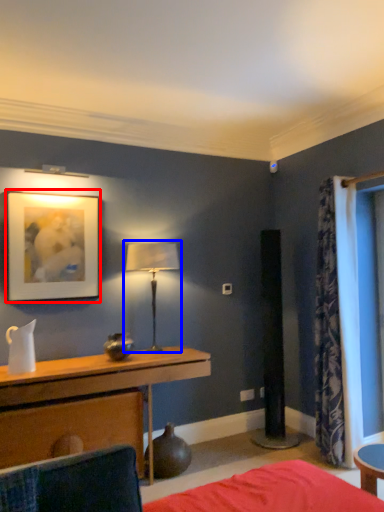
Question: Which object appears farthest to the camera in this image, picture frame (highlighted by a red box) or table lamp (highlighted by a blue box)?

Choices:
 (A) picture frame
 (B) table lamp

Answer: (B)